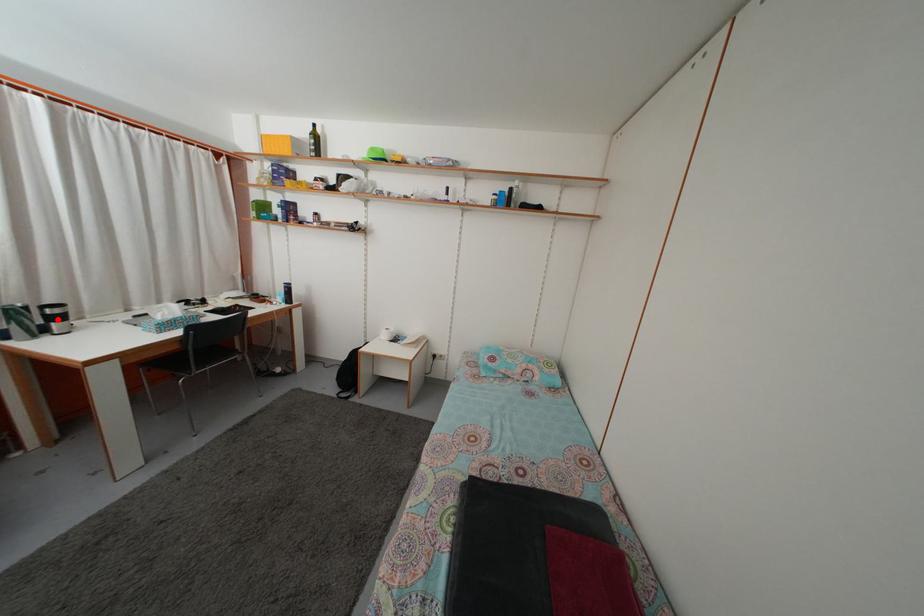
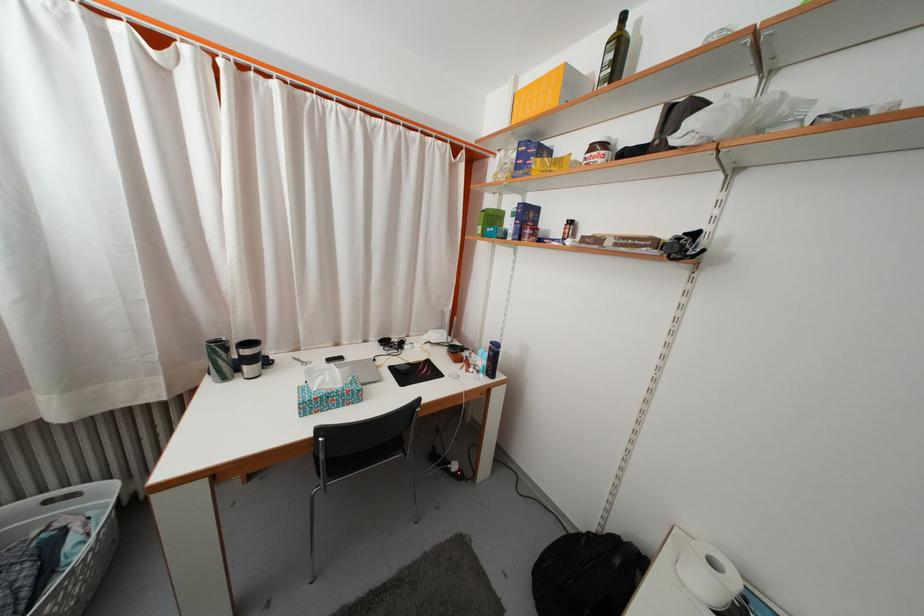
Where in the second image is the point corresponding to the highlighted location from the first image?

(251, 359)